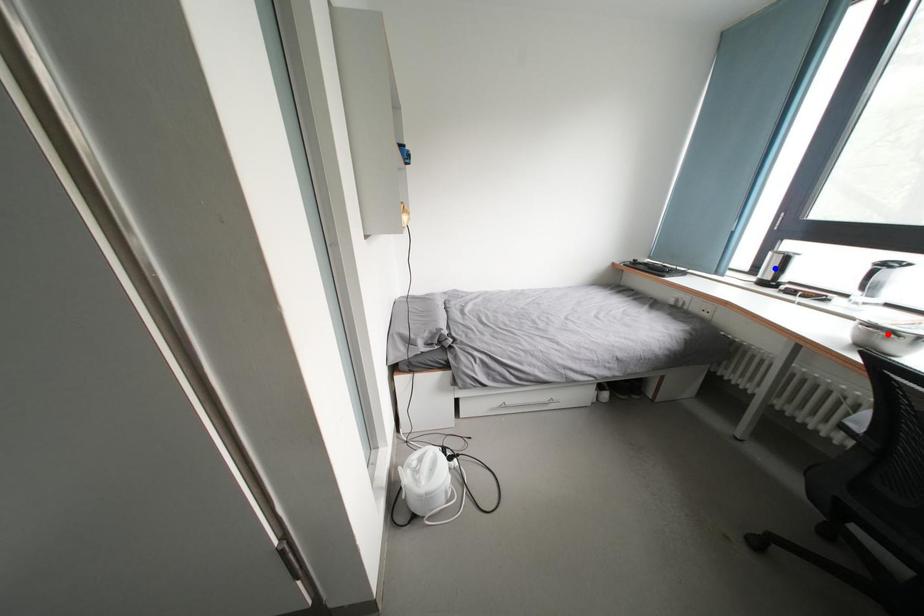
Question: Two points are marked on the image. Which point is closer to the camera?

Choices:
 (A) Blue point is closer.
 (B) Red point is closer.

Answer: (B)